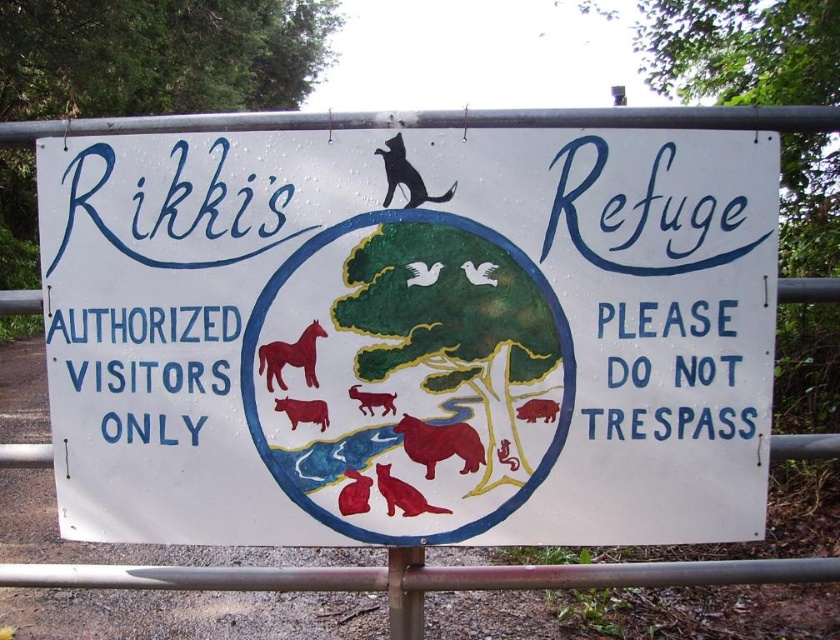
Question: Among these points, which one is nearest to the camera?

Choices:
 (A) (90, 378)
 (B) (360, 502)
 (C) (411, 506)
 (D) (366, 397)

Answer: (D)

Question: Which of these objects is positioned farthest from the matte red cat at center?

Choices:
 (A) red matte cat at lower center
 (B) brown matte dog at center
 (C) smooth red bear at center

Answer: (B)

Question: Which of the following is the closest to the observer?

Choices:
 (A) black matte cat at upper center
 (B) matte red pig at center
 (C) white matte dove at center
 (D) white paper sign at center

Answer: (A)

Question: Is blue painted text at lower left wider than matte red cat at center?

Choices:
 (A) no
 (B) yes

Answer: (B)

Question: Can you confirm if smooth red bear at center is positioned to the right of black matte cat at upper center?

Choices:
 (A) yes
 (B) no

Answer: (A)

Question: Is the position of smooth brown cow at center less distant than that of smooth yellow lizard at center?

Choices:
 (A) no
 (B) yes

Answer: (B)